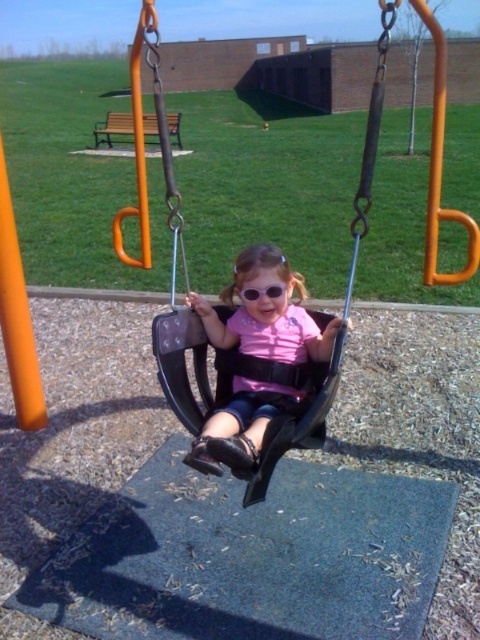
Can you confirm if black plastic swing at center is positioned to the left of transparent plastic goggles at center?

Indeed, black plastic swing at center is positioned on the left side of transparent plastic goggles at center.

You are a GUI agent. You are given a task and a screenshot of the screen. Output one action in this format:
    pyautogui.click(x=<x>, y=<y>)
    Task: Click on the black plastic swing at center
    Image resolution: width=480 pixels, height=640 pixels.
    Given the screenshot: What is the action you would take?
    pyautogui.click(x=230, y=388)

Does black plastic swing at center have a lesser width compared to matte black swing at center?

In fact, black plastic swing at center might be wider than matte black swing at center.

Where is `black plastic swing at center`? This screenshot has width=480, height=640. black plastic swing at center is located at coordinates (230, 388).

Which is below, matte black swing at center or transparent plastic goggles at center?

matte black swing at center is lower down.

Can you confirm if matte black swing at center is bigger than transparent plastic goggles at center?

Indeed, matte black swing at center has a larger size compared to transparent plastic goggles at center.

Describe the element at coordinates (266, 312) in the screenshot. I see `matte black swing at center` at that location.

You are a GUI agent. You are given a task and a screenshot of the screen. Output one action in this format:
    pyautogui.click(x=<x>, y=<y>)
    Task: Click on the matte black swing at center
    
    Given the screenshot: What is the action you would take?
    pyautogui.click(x=266, y=312)